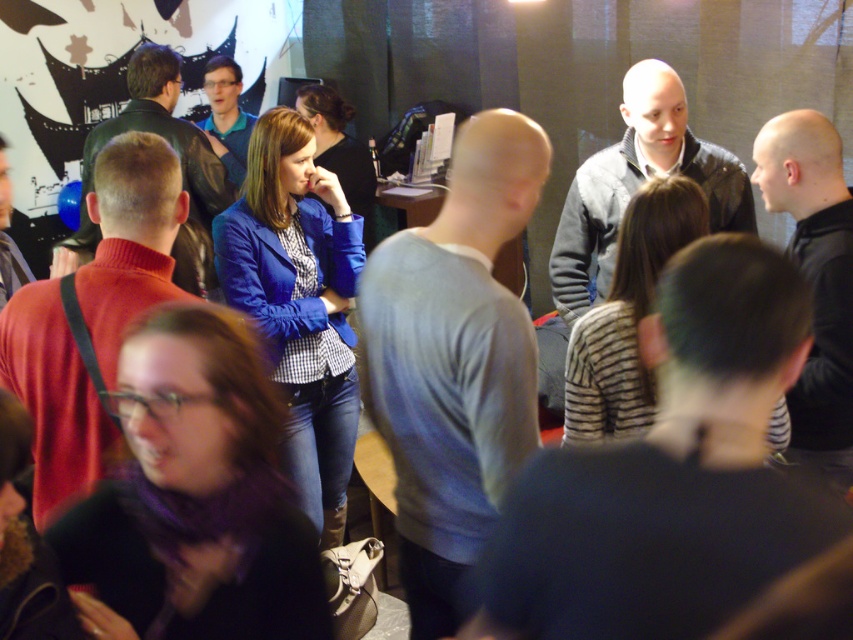
Consider the image. You are standing in the room and see the point at coordinates (815, 282). Which object is this point located on?

The point at coordinates (815, 282) is located on the black leather jacket at right.

You are organizing a photo shoot and need to arrange two models wearing the dark gray sweater at center and the black leather jacket at right. The photographer wants the smaller clothing item to be placed closer to the camera. Which model should stand closer to the camera?

The dark gray sweater at center is smaller than the black leather jacket at right, so the model wearing the dark gray sweater at center should stand closer to the camera to make the smaller clothing item appear in focus and prominent in the photo.

From the picture: You are standing in the room and want to move from the point at coordinates point (659, 285) to the point at coordinates point (231, 134). Which direction should you move to get closer to your destination?

You should move towards the lower left direction because point (231, 134) is further away from the viewer compared to point (659, 285), so moving lower left would take you closer to the destination.